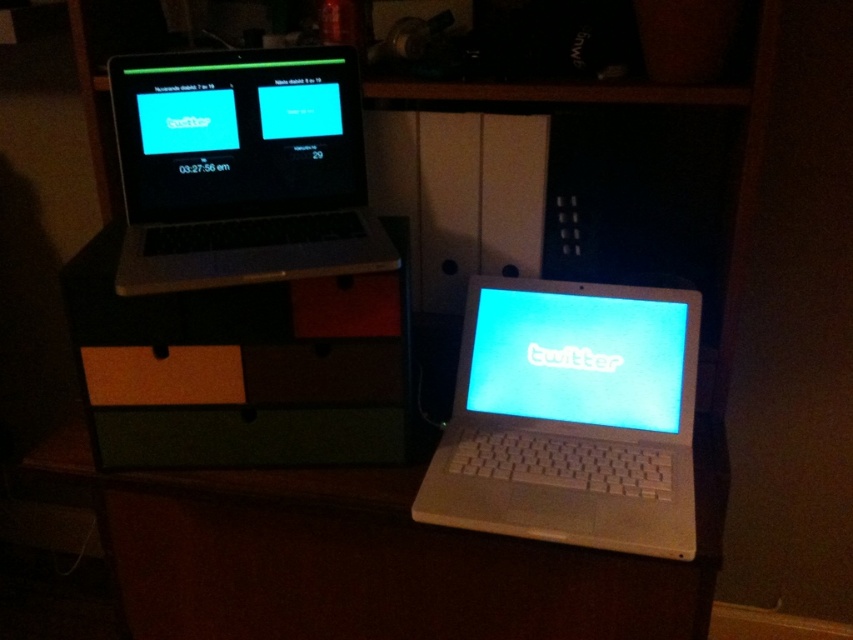
Question: Among these objects, which one is nearest to the camera?

Choices:
 (A) satin black laptop at upper left
 (B) white plastic table at lower right
 (C) white plastic laptop at center

Answer: (A)

Question: Does white plastic table at lower right have a greater width compared to white plastic laptop at center?

Choices:
 (A) yes
 (B) no

Answer: (A)

Question: Which object appears farthest from the camera in this image?

Choices:
 (A) white plastic laptop at center
 (B) white plastic table at lower right
 (C) satin black laptop at upper left

Answer: (B)

Question: Which point is farther from the camera taking this photo?

Choices:
 (A) (471, 420)
 (B) (628, 586)
 (C) (376, 232)

Answer: (A)

Question: Does white plastic table at lower right appear over satin black laptop at upper left?

Choices:
 (A) yes
 (B) no

Answer: (B)

Question: Does white plastic table at lower right have a smaller size compared to white plastic laptop at center?

Choices:
 (A) no
 (B) yes

Answer: (A)